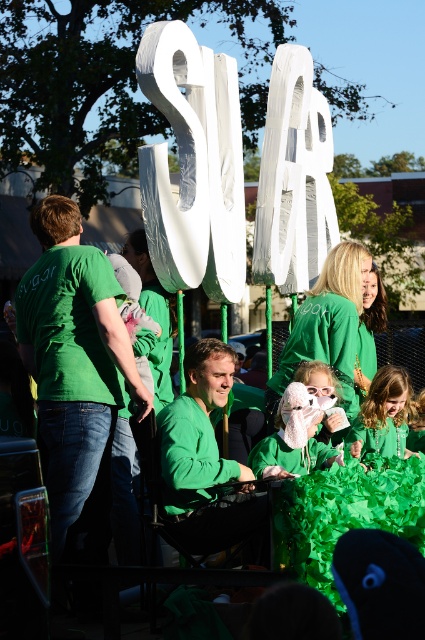
Question: Can you confirm if green cotton shirt at left is wider than green matte shirt at center?

Choices:
 (A) yes
 (B) no

Answer: (A)

Question: Which object is positioned closest to the white fluffy hat at center?

Choices:
 (A) green matte shirt at center
 (B) matte green sweater at center
 (C) white plush toy at center
 (D) green cotton shirt at left

Answer: (C)

Question: Does matte green sweater at center appear on the right side of white plush toy at center?

Choices:
 (A) yes
 (B) no

Answer: (A)

Question: Does green matte shirt at center appear under matte green sweater at center?

Choices:
 (A) yes
 (B) no

Answer: (B)

Question: Which of these objects is positioned closest to the green matte shirt at center?

Choices:
 (A) white plush toy at center
 (B) green cotton shirt at left

Answer: (A)

Question: Which object is closer to the camera taking this photo?

Choices:
 (A) white fluffy hat at center
 (B) green cotton shirt at left
 (C) matte green sweater at center

Answer: (A)